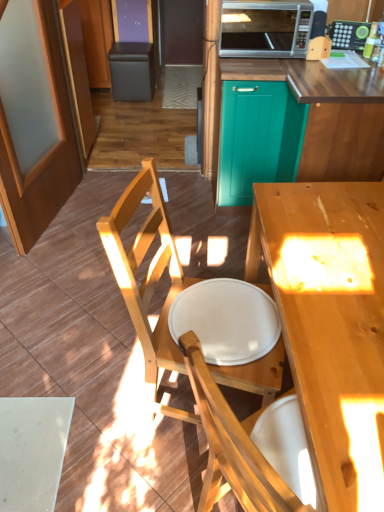
I want to click on free spot in front of wooden screen door at left, placed as the second screen door when sorted from right to left, so click(55, 270).